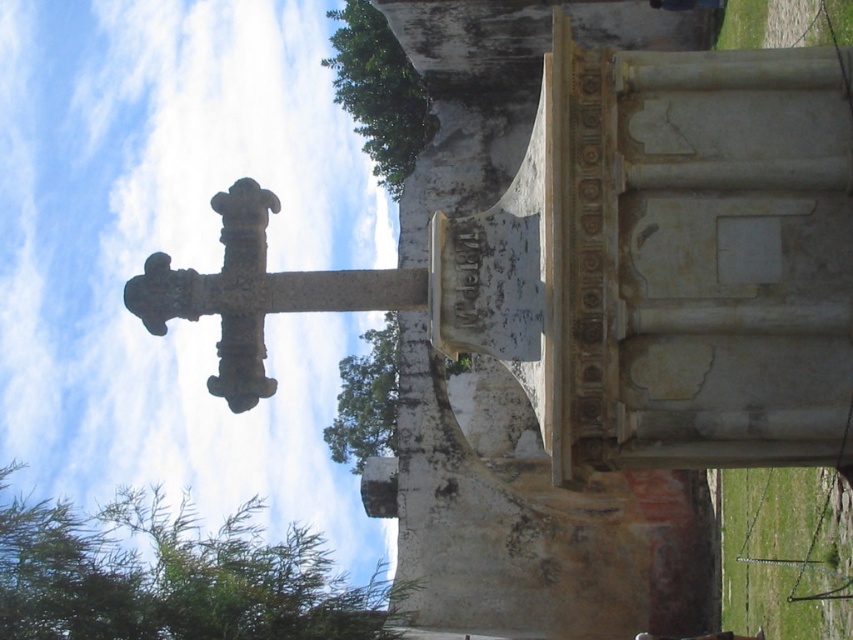
Can you confirm if green leafy tree at lower left is bigger than carved stone cross at center?

Yes.

Who is lower down, green leafy tree at lower left or carved stone cross at center?

green leafy tree at lower left is lower down.

Is point (222, 557) less distant than point (157, 307)?

That is False.

At what (x,y) coordinates should I click in order to perform the action: click on green leafy tree at lower left. Please return your answer as a coordinate pair (x, y). The height and width of the screenshot is (640, 853). Looking at the image, I should click on (172, 577).

Based on the photo, which is more to the right, green leafy tree at lower left or green leafy tree at upper center?

From the viewer's perspective, green leafy tree at upper center appears more on the right side.

Is point (48, 561) positioned behind point (386, 157)?

No, (48, 561) is in front of (386, 157).

What do you see at coordinates (172, 577) in the screenshot? The width and height of the screenshot is (853, 640). I see `green leafy tree at lower left` at bounding box center [172, 577].

Where is `green leafy tree at lower left`? The width and height of the screenshot is (853, 640). green leafy tree at lower left is located at coordinates (172, 577).

Can you confirm if green leafy tree at upper center is positioned to the left of green leafy tree at center?

In fact, green leafy tree at upper center is to the right of green leafy tree at center.

Can you confirm if green leafy tree at upper center is bigger than green leafy tree at center?

Indeed, green leafy tree at upper center has a larger size compared to green leafy tree at center.

Measure the distance between green leafy tree at upper center and camera.

A distance of 116.29 meters exists between green leafy tree at upper center and camera.

Identify the location of green leafy tree at upper center. The height and width of the screenshot is (640, 853). (378, 92).